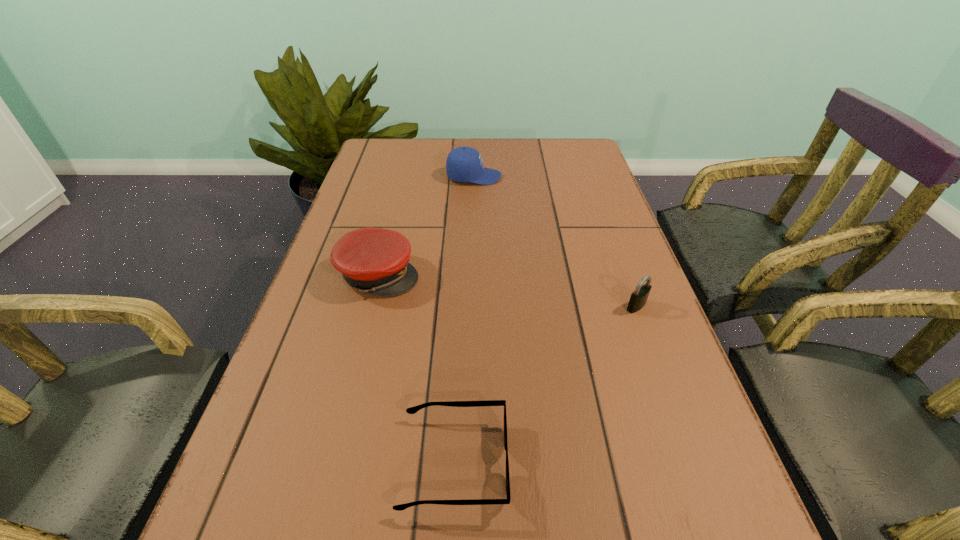
Locate an element on the screen. free space between the rightmost object and the farther cap is located at coordinates (555, 241).

The image size is (960, 540). In order to click on empty space between the right cap and the rightmost object in this screenshot , I will do `click(555, 241)`.

I want to click on empty location between the left cap and the farther cap, so click(x=426, y=226).

Where is `empty location between the farther cap and the rightmost object`? Image resolution: width=960 pixels, height=540 pixels. empty location between the farther cap and the rightmost object is located at coordinates (555, 241).

You are a GUI agent. You are given a task and a screenshot of the screen. Output one action in this format:
    pyautogui.click(x=<x>, y=<y>)
    Task: Click on the free space between the shortest object and the farthest object
    The width and height of the screenshot is (960, 540).
    Given the screenshot: What is the action you would take?
    pyautogui.click(x=464, y=320)

I want to click on vacant space in between the shortest object and the rightmost object, so click(545, 384).

The height and width of the screenshot is (540, 960). What are the coordinates of `empty space between the farther cap and the padlock` in the screenshot? It's located at (555, 241).

What are the coordinates of `unoccupied area between the farthest object and the leftmost object` in the screenshot? It's located at (426, 226).

At what (x,y) coordinates should I click in order to perform the action: click on empty location between the farther cap and the nearest object. Please return your answer as a coordinate pair (x, y). The image size is (960, 540). Looking at the image, I should click on (464, 320).

This screenshot has width=960, height=540. Identify the location of object that is the third nearest to the farthest object. (412, 410).